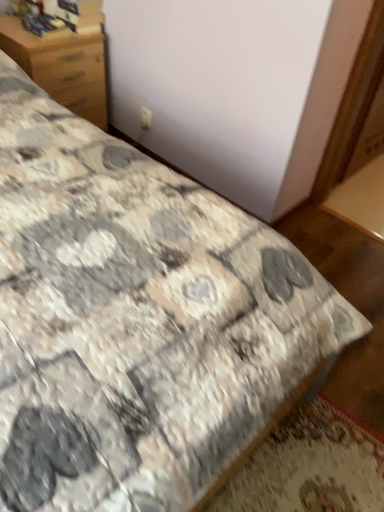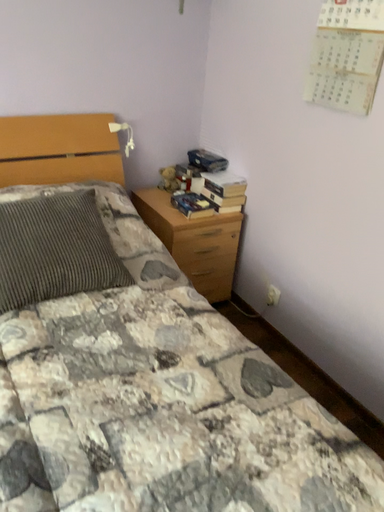
Question: How did the camera likely rotate when shooting the video?

Choices:
 (A) rotated right
 (B) rotated left

Answer: (B)